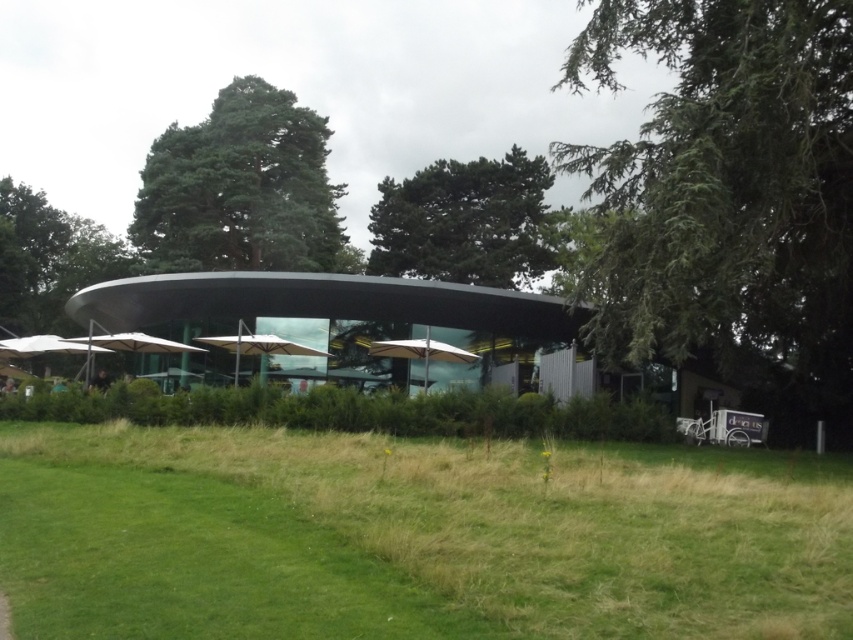
Does green leafy tree at upper center have a greater width compared to beige fabric umbrella at center?

Indeed, green leafy tree at upper center has a greater width compared to beige fabric umbrella at center.

Who is more distant from viewer, (154, 198) or (379, 348)?

The point (154, 198) is more distant.

You are a GUI agent. You are given a task and a screenshot of the screen. Output one action in this format:
    pyautogui.click(x=<x>, y=<y>)
    Task: Click on the green leafy tree at upper center
    
    Given the screenshot: What is the action you would take?
    pyautogui.click(x=242, y=189)

Is green needle-like leaves at right smaller than white fabric umbrella at lower left?

Actually, green needle-like leaves at right might be larger than white fabric umbrella at lower left.

Does green needle-like leaves at right appear under white fabric umbrella at lower left?

No, green needle-like leaves at right is not below white fabric umbrella at lower left.

Where is `green needle-like leaves at right`? This screenshot has height=640, width=853. green needle-like leaves at right is located at coordinates (729, 196).

Based on the photo, can you confirm if transparent glass umbrella at center is positioned above white matte umbrella at left?

Indeed, transparent glass umbrella at center is positioned over white matte umbrella at left.

Which is in front, point (241, 342) or point (38, 348)?

Point (241, 342)

Where is `transparent glass umbrella at center`? transparent glass umbrella at center is located at coordinates (258, 346).